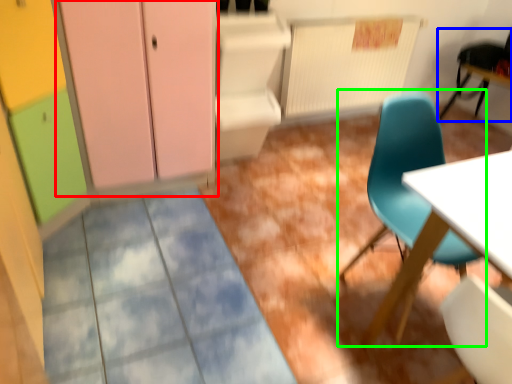
Question: Which is nearer to the dresser (highlighted by a red box)? chair (highlighted by a blue box) or chair (highlighted by a green box).

Choices:
 (A) chair
 (B) chair

Answer: (B)